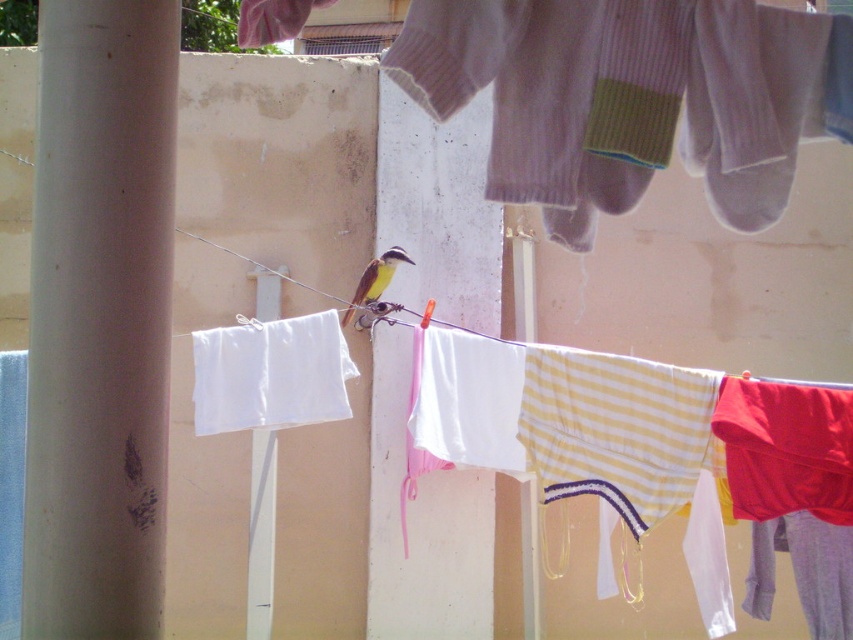
You are standing in front of the clothesline and see the white smooth pole at left and the white smooth pole at center. Which pole is located to the right side of the other?

The white smooth pole at left is to the right of the white smooth pole at center.

You are standing at the center of the image and want to locate the white smooth pole at center. Which direction should you look to find it?

The white smooth pole at center is located at point coordinates of 0.836 on the x axis and 0.307 on the y axis. Since you are at the center of the image, you should look towards the right side because the x coordinate of the white smooth pole at center is greater than 0.5, indicating it is to the right of the center.

You are a small bird perched on the clothesline and want to fly to the white smooth pole at left. Which direction should you fly to reach it without passing through the ribbed wool socks at upper center?

The white smooth pole at left is further to the viewer than the ribbed wool socks at upper center, so you should fly forward towards the pole since it is closer to you than the socks.